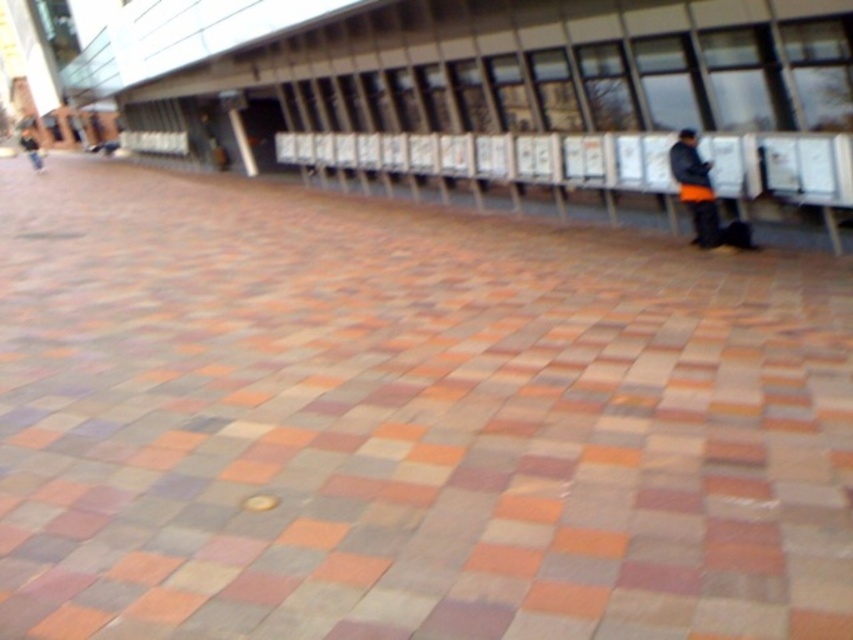
Question: Among these points, which one is nearest to the camera?

Choices:
 (A) (33, 164)
 (B) (701, 163)
 (C) (674, 168)

Answer: (B)

Question: Does orange fabric jacket at right appear on the left side of dark blue jeans at left?

Choices:
 (A) yes
 (B) no

Answer: (B)

Question: Which point is closer to the camera?

Choices:
 (A) (695, 156)
 (B) (28, 154)

Answer: (A)

Question: Does orange fabric jacket at right come behind dark blue jeans at left?

Choices:
 (A) yes
 (B) no

Answer: (B)

Question: Does orange fabric jacket at right appear on the right side of dark blue jeans at left?

Choices:
 (A) yes
 (B) no

Answer: (A)

Question: Which of the following is the closest to the observer?

Choices:
 (A) dark blue jeans at left
 (B) orange fabric jacket at right
 (C) black matte jacket at right

Answer: (C)